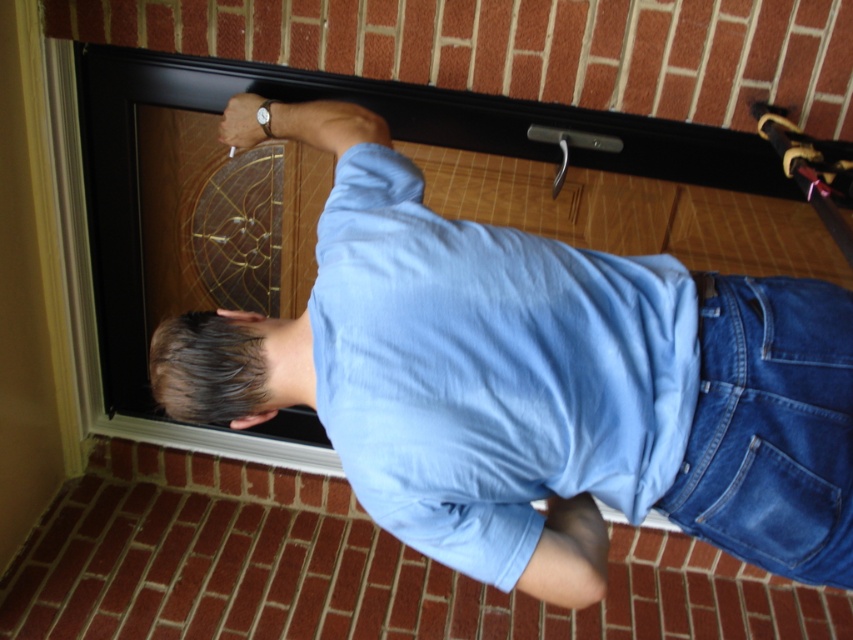
Who is shorter, light blue cotton shirt at center or denim at lower right?

denim at lower right

Does light blue cotton shirt at center appear under denim at lower right?

Actually, light blue cotton shirt at center is above denim at lower right.

Is point (494, 369) more distant than point (795, 426)?

Yes, it is.

This screenshot has width=853, height=640. Identify the location of light blue cotton shirt at center. (490, 369).

Does point (364, 230) come behind point (424, 428)?

Yes, point (364, 230) is behind point (424, 428).

In order to click on blue denim shirt at upper center in this screenshot , I will do `click(532, 381)`.

Which is below, blue denim shirt at upper center or denim at lower right?

denim at lower right

Between blue denim shirt at upper center and denim at lower right, which one is positioned higher?

blue denim shirt at upper center is higher up.

The image size is (853, 640). What do you see at coordinates (532, 381) in the screenshot?
I see `blue denim shirt at upper center` at bounding box center [532, 381].

I want to click on blue denim shirt at upper center, so click(532, 381).